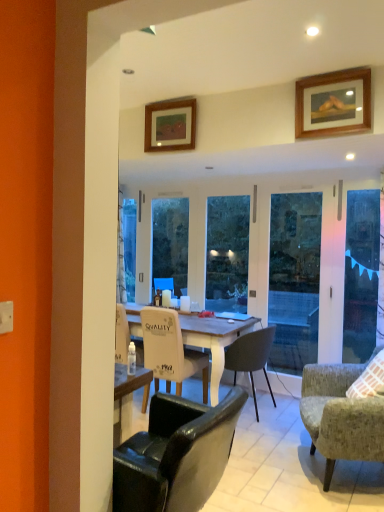
Question: Considering the positions of point (248, 370) and point (195, 306), is point (248, 370) closer or farther from the camera than point (195, 306)?

Choices:
 (A) closer
 (B) farther

Answer: (A)

Question: Do you think matte black chair at center, which is the 4th chair from front to back, is within matte white coffee cup at center, arranged as the 1th coffee cup when viewed from the right, or outside of it?

Choices:
 (A) outside
 (B) inside

Answer: (A)

Question: Which object is positioned farthest from the leather-like black chair at lower center, marked as the 1th chair in a front-to-back arrangement?

Choices:
 (A) transparent glass screen door at right
 (B) white glossy coffee cup at center, which appears as the second coffee cup when viewed from the left
 (C) white fabric chair at center, arranged as the 3th chair when viewed from the front
 (D) wooden picture frame at upper right, which appears as the 2th picture frame when viewed from the left
 (E) textured gray armchair at lower right, the second chair positioned from the front

Answer: (A)

Question: Which is farther from the leather-like black chair at lower center, the fourth chair viewed from the back?

Choices:
 (A) wooden picture frame at upper right, acting as the 2th picture frame starting from the back
 (B) matte white coffee cup at center, which is the third coffee cup in left-to-right order
 (C) transparent glass screen door at right
 (D) wooden picture frame at upper center, placed as the second picture frame when sorted from front to back
 (E) matte black chair at center, the first chair when ordered from back to front

Answer: (C)